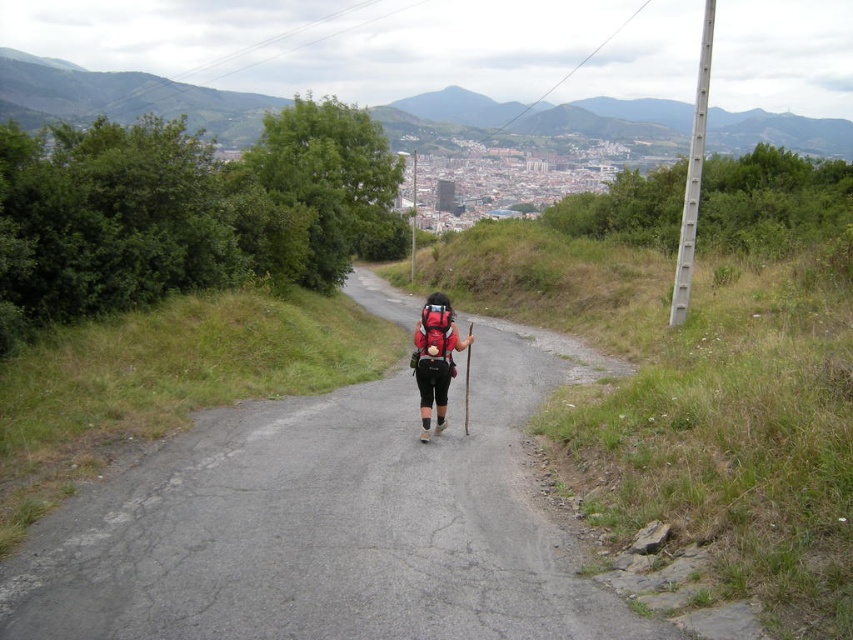
You are the hiker in the image. You want to place your matte black backpack at center onto the asphalt road at center. Is the backpack in front of or behind the road?

The asphalt road at center is in front of the matte black backpack at center, so the backpack is behind the road.

In the scene shown: You are a drone operator trying to capture aerial footage of the hiker. You have two points marked in the scene, point A at coordinates point (x=454, y=483) and point B at coordinates point (x=424, y=310). Which point is closer to the camera so you can focus there?

Point point (x=454, y=483) is closer to the camera than point point (x=424, y=310), so you should focus there.